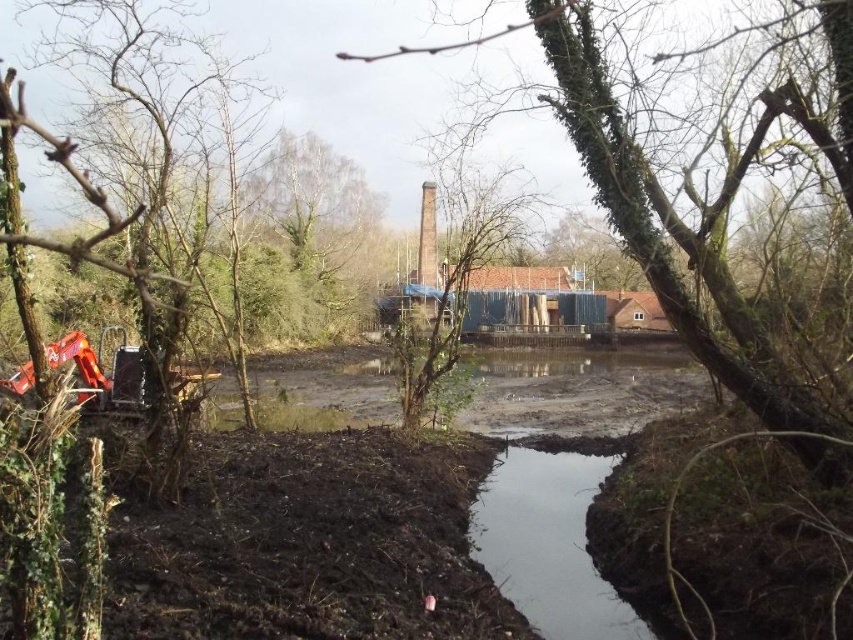
Who is positioned more to the right, clear water at center or green mossy tree at center?

From the viewer's perspective, clear water at center appears more on the right side.

Is clear water at center shorter than green mossy tree at center?

Yes, clear water at center is shorter than green mossy tree at center.

The height and width of the screenshot is (640, 853). In order to click on clear water at center in this screenshot , I will do (548, 544).